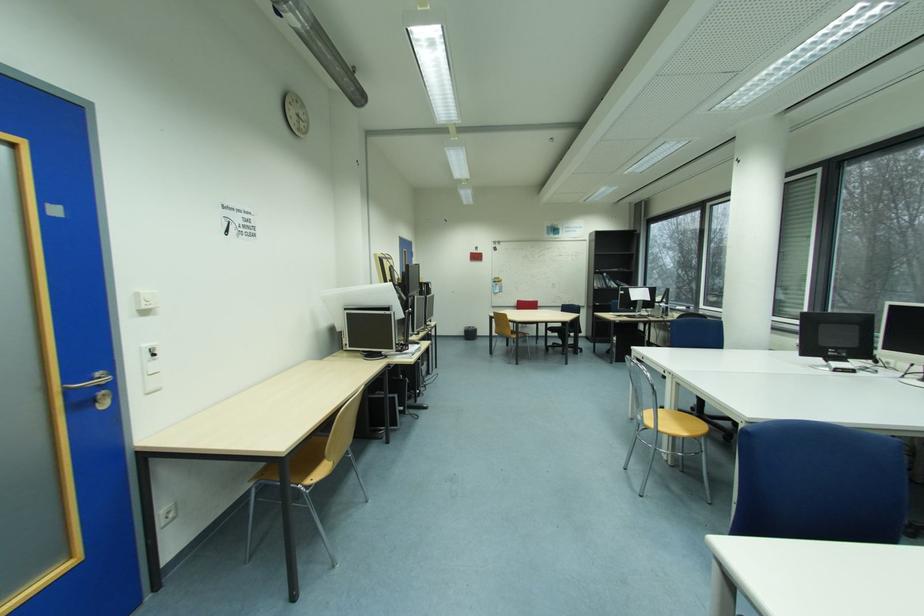
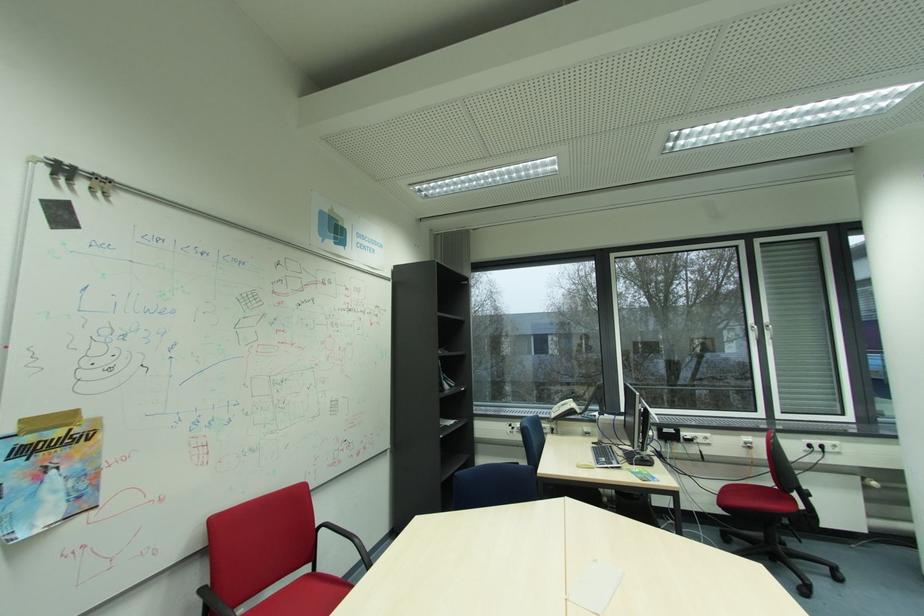
Where in the second image is the point corresponding to (x=502, y=283) from the first image?

(31, 452)